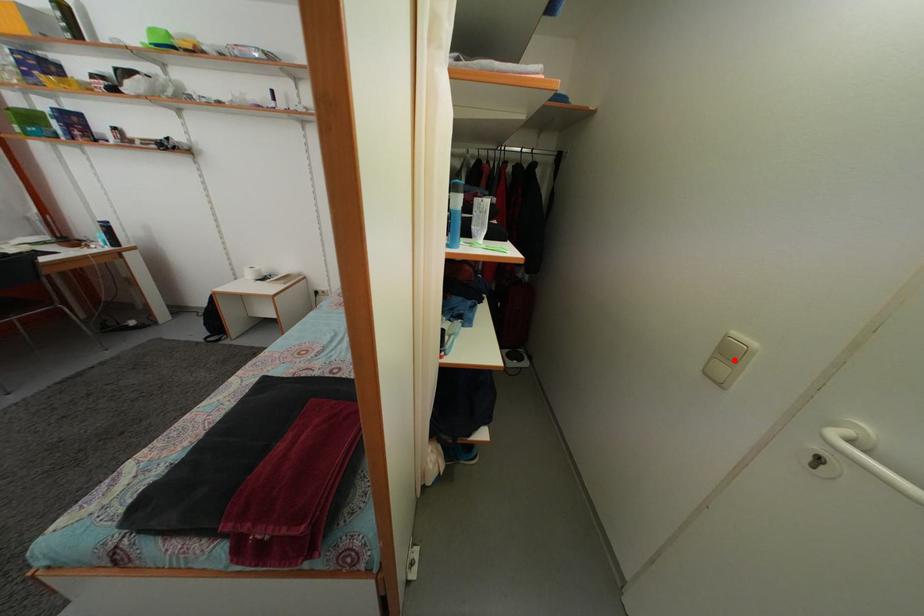
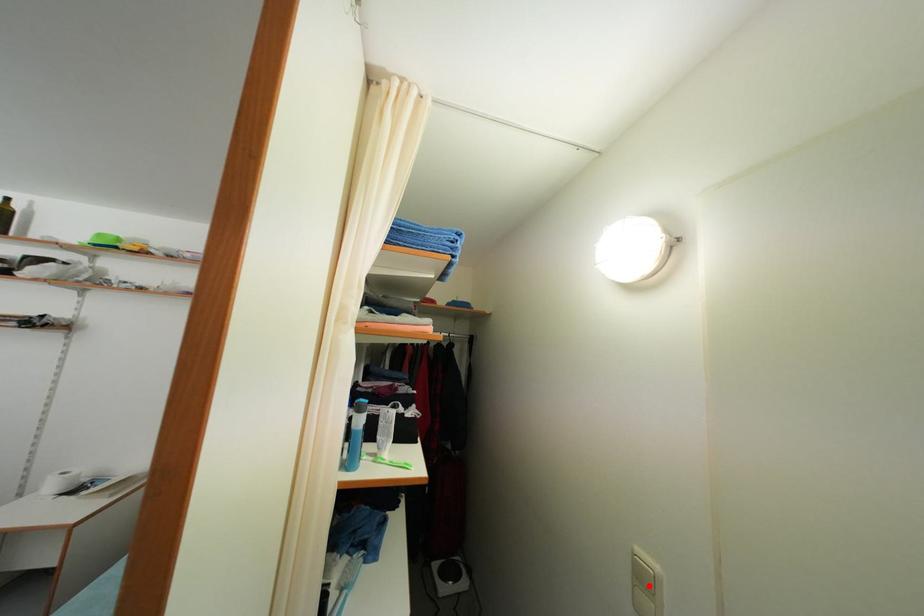
I am providing you with two images of the same scene from different viewpoints. A red point is marked on the first image and another point is marked on the second image. Do the highlighted points in image1 and image2 indicate the same real-world spot?

Yes